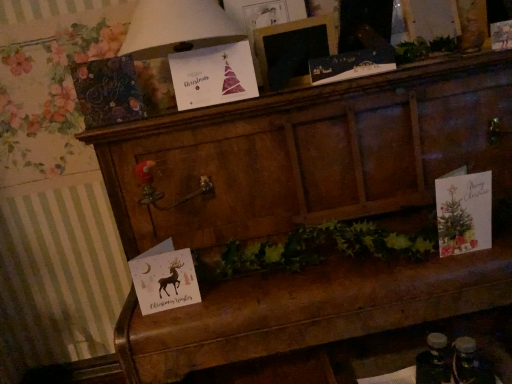
Identify the location of matte paper card at right, the second christmas card in the bottom-to-top sequence. (464, 212).

Image resolution: width=512 pixels, height=384 pixels. What do you see at coordinates (164, 278) in the screenshot? I see `matte white card with reindeer at lower left, arranged as the first christmas card when ordered from the bottom` at bounding box center [164, 278].

Where is `watercolor paper christmas card at upper center, arranged as the 2th christmas card when viewed from the left`? watercolor paper christmas card at upper center, arranged as the 2th christmas card when viewed from the left is located at coordinates (213, 75).

What do you see at coordinates (213, 75) in the screenshot? I see `watercolor paper christmas card at upper center, acting as the 3th christmas card starting from the bottom` at bounding box center [213, 75].

You are a GUI agent. You are given a task and a screenshot of the screen. Output one action in this format:
    pyautogui.click(x=<x>, y=<y>)
    Task: Click on the white paper christmas card at upper center
    This screenshot has width=512, height=384.
    Given the screenshot: What is the action you would take?
    pyautogui.click(x=178, y=28)

The image size is (512, 384). Describe the element at coordinates (312, 154) in the screenshot. I see `wooden chest at center` at that location.

I want to click on matte paper card at right, positioned as the 3th christmas card in top-to-bottom order, so click(x=464, y=212).

From a real-world perspective, relative to matte white card with reindeer at lower left, marked as the 1th christmas card in a left-to-right arrangement, is matte black card at upper center, the 2th christmas card viewed from the right, vertically above or below?

matte black card at upper center, the 2th christmas card viewed from the right, is above matte white card with reindeer at lower left, marked as the 1th christmas card in a left-to-right arrangement.

Considering the relative positions of matte black card at upper center, which ranks as the third christmas card in left-to-right order, and matte white card with reindeer at lower left, arranged as the first christmas card when ordered from the bottom, in the image provided, is matte black card at upper center, which ranks as the third christmas card in left-to-right order, to the right of matte white card with reindeer at lower left, arranged as the first christmas card when ordered from the bottom, from the viewer's perspective?

Indeed, matte black card at upper center, which ranks as the third christmas card in left-to-right order, is positioned on the right side of matte white card with reindeer at lower left, arranged as the first christmas card when ordered from the bottom.

Based on the photo, is matte black card at upper center, the 2th christmas card viewed from the right, oriented away from matte white card with reindeer at lower left, arranged as the first christmas card when ordered from the bottom?

No, matte black card at upper center, the 2th christmas card viewed from the right,'s orientation is not away from matte white card with reindeer at lower left, arranged as the first christmas card when ordered from the bottom.

From their relative heights in the image, would you say watercolor paper christmas card at upper center, acting as the 3th christmas card starting from the bottom, is taller or shorter than wooden picture frame at upper center?

Considering their sizes, watercolor paper christmas card at upper center, acting as the 3th christmas card starting from the bottom, has less height than wooden picture frame at upper center.

Relative to wooden picture frame at upper center, is watercolor paper christmas card at upper center, arranged as the second christmas card when viewed from the top, in front or behind?

watercolor paper christmas card at upper center, arranged as the second christmas card when viewed from the top, is positioned closer to the viewer than wooden picture frame at upper center.

From a real-world perspective, between watercolor paper christmas card at upper center, arranged as the 3th christmas card when viewed from the right, and wooden picture frame at upper center, who is vertically higher?

wooden picture frame at upper center is physically above.

Locate an element on the screen. Image resolution: width=512 pixels, height=384 pixels. the 2nd christmas card in front of the wooden picture frame at upper center is located at coordinates (213, 75).

From the image's perspective, is matte black card at upper center, the first christmas card from the top, below matte paper card at right, the first christmas card from the right?

No, from the image's perspective, matte black card at upper center, the first christmas card from the top, is not beneath matte paper card at right, the first christmas card from the right.

Can you confirm if matte black card at upper center, which is the 4th christmas card in bottom-to-top order, is wider than matte paper card at right, positioned as the 3th christmas card in top-to-bottom order?

No.

From the image's perspective, which christmas card is the 2nd one below the matte black card at upper center, which ranks as the third christmas card in left-to-right order? Please provide its 2D coordinates.

[(464, 212)]

From the picture: Is matte black card at upper center, which ranks as the third christmas card in left-to-right order, looking in the opposite direction of matte paper card at right, positioned as the 3th christmas card in top-to-bottom order?

No, matte paper card at right, positioned as the 3th christmas card in top-to-bottom order, is not at the back of matte black card at upper center, which ranks as the third christmas card in left-to-right order.

Considering the sizes of objects wooden chest at center and matte black card at upper center, the 2th christmas card viewed from the right, in the image provided, who is taller, wooden chest at center or matte black card at upper center, the 2th christmas card viewed from the right,?

With more height is wooden chest at center.

Considering the positions of objects wooden chest at center and matte black card at upper center, which is the 4th christmas card in bottom-to-top order, in the image provided, who is more to the left, wooden chest at center or matte black card at upper center, which is the 4th christmas card in bottom-to-top order,?

From the viewer's perspective, matte black card at upper center, which is the 4th christmas card in bottom-to-top order, appears more on the left side.

From a real-world perspective, which object rests below the other?

wooden chest at center, from a real-world perspective.

Is matte black card at upper center, the 2th christmas card viewed from the right, at the back of wooden chest at center?

Result: That's not correct — wooden chest at center is not looking away from matte black card at upper center, the 2th christmas card viewed from the right.

Could you tell me if wooden picture frame at upper center is facing watercolor paper christmas card at upper center, arranged as the second christmas card when viewed from the top?

No, wooden picture frame at upper center is not aimed at watercolor paper christmas card at upper center, arranged as the second christmas card when viewed from the top.

Based on the photo, from their relative heights in the image, would you say wooden picture frame at upper center is taller or shorter than watercolor paper christmas card at upper center, acting as the 3th christmas card starting from the bottom?

Clearly, wooden picture frame at upper center is taller compared to watercolor paper christmas card at upper center, acting as the 3th christmas card starting from the bottom.

Considering the sizes of objects wooden picture frame at upper center and watercolor paper christmas card at upper center, arranged as the second christmas card when viewed from the top, in the image provided, who is thinner, wooden picture frame at upper center or watercolor paper christmas card at upper center, arranged as the second christmas card when viewed from the top,?

With smaller width is wooden picture frame at upper center.

Is wooden chest at center situated inside matte white card with reindeer at lower left, marked as the 1th christmas card in a left-to-right arrangement, or outside?

wooden chest at center lies outside matte white card with reindeer at lower left, marked as the 1th christmas card in a left-to-right arrangement.

Between wooden chest at center and matte white card with reindeer at lower left, placed as the fourth christmas card when sorted from top to bottom, which one is positioned in front?

wooden chest at center is more forward.

What are the coordinates of `the 1st christmas card above the wooden chest at center (from a real-world perspective)` in the screenshot? It's located at (164, 278).

Are matte white card with reindeer at lower left, arranged as the first christmas card when ordered from the bottom, and matte paper card at right, positioned as the 3th christmas card in top-to-bottom order, making contact?

No, matte white card with reindeer at lower left, arranged as the first christmas card when ordered from the bottom, is not making contact with matte paper card at right, positioned as the 3th christmas card in top-to-bottom order.

From the picture: Would you say matte paper card at right, the second christmas card in the bottom-to-top sequence, is part of matte white card with reindeer at lower left, arranged as the first christmas card when ordered from the bottom,'s contents?

No, matte paper card at right, the second christmas card in the bottom-to-top sequence, is not surrounded by matte white card with reindeer at lower left, arranged as the first christmas card when ordered from the bottom.

Between matte white card with reindeer at lower left, marked as the 1th christmas card in a left-to-right arrangement, and matte paper card at right, which is counted as the fourth christmas card, starting from the left, which one has larger size?

matte paper card at right, which is counted as the fourth christmas card, starting from the left.

You are a GUI agent. You are given a task and a screenshot of the screen. Output one action in this format:
    pyautogui.click(x=<x>, y=<y>)
    Task: Click on the 3rd christmas card above when counting from the matte white card with reindeer at lower left, arranged as the first christmas card when ordered from the bottom (from the image's perspective)
    This screenshot has width=512, height=384.
    Given the screenshot: What is the action you would take?
    pyautogui.click(x=351, y=65)

The width and height of the screenshot is (512, 384). Find the location of `christmas card that is the 1st one below the wooden picture frame at upper center (from a real-world perspective)`. christmas card that is the 1st one below the wooden picture frame at upper center (from a real-world perspective) is located at coordinates (213, 75).

Based on their spatial positions, is matte white card with reindeer at lower left, which ranks as the fourth christmas card in right-to-left order, or watercolor paper christmas card at upper center, arranged as the second christmas card when viewed from the top, closer to wooden picture frame at upper center?

watercolor paper christmas card at upper center, arranged as the second christmas card when viewed from the top.

Estimate the real-world distances between objects in this image. Which object is further from wooden picture frame at upper center, matte white card with reindeer at lower left, marked as the 1th christmas card in a left-to-right arrangement, or matte black card at upper center, the first christmas card from the top?

matte white card with reindeer at lower left, marked as the 1th christmas card in a left-to-right arrangement, is positioned further to the anchor wooden picture frame at upper center.

Considering their positions, is wooden chest at center positioned closer to matte white card with reindeer at lower left, marked as the 1th christmas card in a left-to-right arrangement, than wooden picture frame at upper center?

wooden chest at center.

Considering their positions, is matte white card with reindeer at lower left, marked as the 1th christmas card in a left-to-right arrangement, positioned closer to white paper christmas card at upper center than wooden picture frame at upper center?

wooden picture frame at upper center.

When comparing their distances from matte black card at upper center, which is the 4th christmas card in bottom-to-top order, does wooden picture frame at upper center or wooden chest at center seem closer?

Among the two, wooden picture frame at upper center is located nearer to matte black card at upper center, which is the 4th christmas card in bottom-to-top order.

Which object lies further to the anchor point wooden picture frame at upper center, matte black card at upper center, the first christmas card from the top, or matte paper card at right, the first christmas card from the right?

matte paper card at right, the first christmas card from the right.

Based on their spatial positions, is watercolor paper christmas card at upper center, arranged as the 2th christmas card when viewed from the left, or matte white card with reindeer at lower left, which ranks as the fourth christmas card in right-to-left order, further from wooden chest at center?

Based on the image, matte white card with reindeer at lower left, which ranks as the fourth christmas card in right-to-left order, appears to be further to wooden chest at center.

Looking at this image, considering their positions, is matte black card at upper center, the first christmas card from the top, positioned further to watercolor paper christmas card at upper center, acting as the 3th christmas card starting from the bottom, than wooden chest at center?

wooden chest at center is positioned further to the anchor watercolor paper christmas card at upper center, acting as the 3th christmas card starting from the bottom.

Identify the location of furniture between watercolor paper christmas card at upper center, arranged as the 2th christmas card when viewed from the left, and matte paper card at right, which is counted as the fourth christmas card, starting from the left, from left to right. (312, 154).

This screenshot has height=384, width=512. In order to click on lamp between matte white card with reindeer at lower left, placed as the fourth christmas card when sorted from top to bottom, and matte paper card at right, the first christmas card from the right, in the horizontal direction in this screenshot , I will do `click(178, 28)`.

I want to click on christmas card between white paper christmas card at upper center and matte black card at upper center, the first christmas card from the top, so click(x=213, y=75).

Where is `furniture situated between white paper christmas card at upper center and matte paper card at right, the first christmas card from the right, from left to right`? This screenshot has width=512, height=384. furniture situated between white paper christmas card at upper center and matte paper card at right, the first christmas card from the right, from left to right is located at coordinates (312, 154).